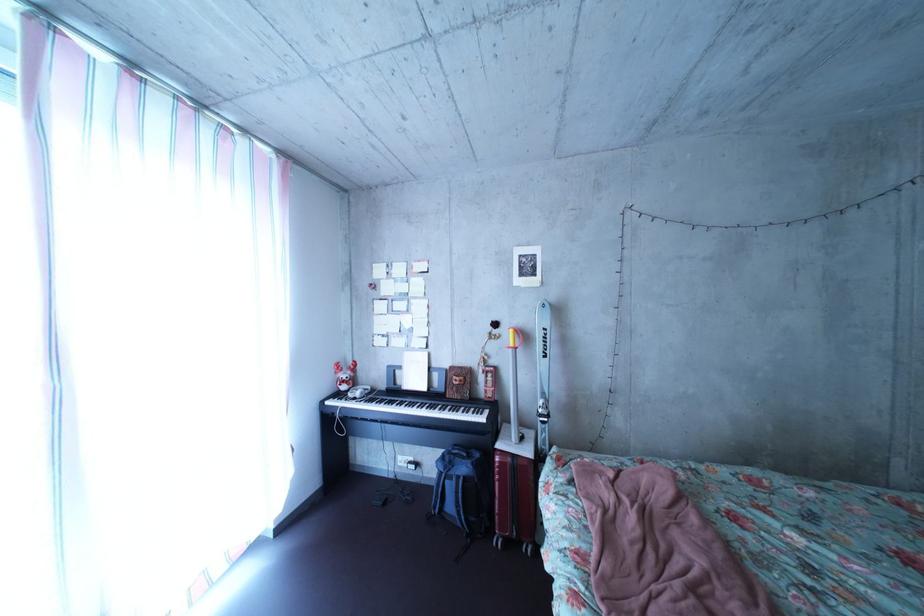
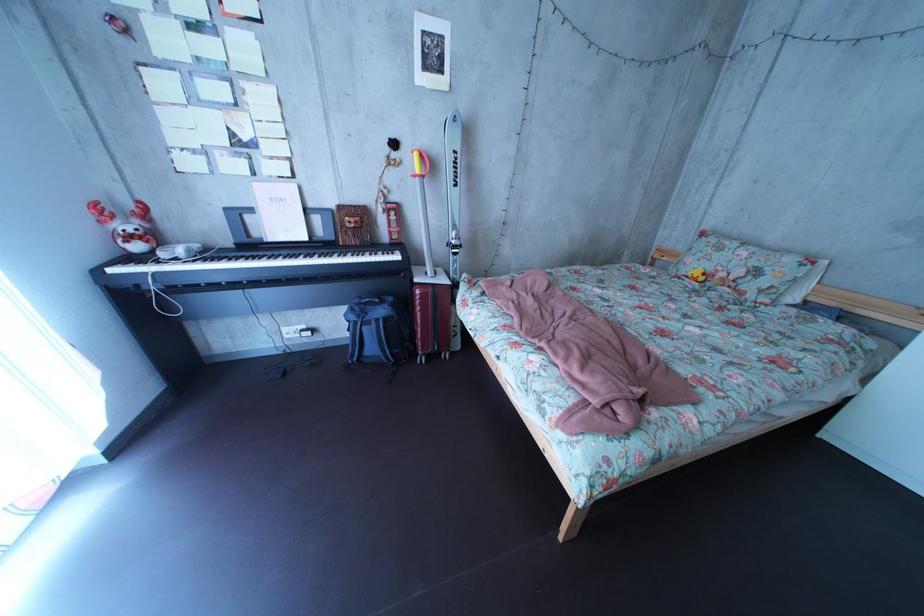
In the second image, find the point that corresponds to (x=386, y=403) in the first image.

(225, 262)